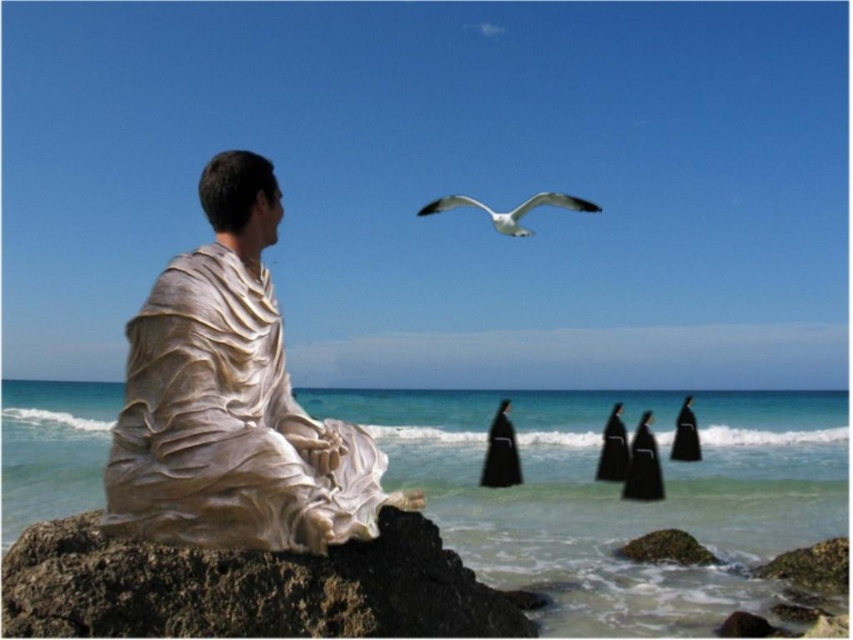
You are standing at the camera position and want to place a 3.5 meter long wooden beam between the rough textured rock at lower left and your current position. Will the beam be long enough to reach the rock?

The distance between the rough textured rock at lower left and the camera is 4.17 meters. The beam is only 3.5 meters long, so it will not be long enough to reach the rock.

From the picture: You are a photographer standing on the rocky outcrop where the statue is located. You want to take a photo that includes both the clear blue water at lower center and the white glossy seagull at upper center. According to the scene description, which object should appear higher in the photo?

The white glossy seagull at upper center should appear higher in the photo because it is positioned above the clear blue water at lower center.